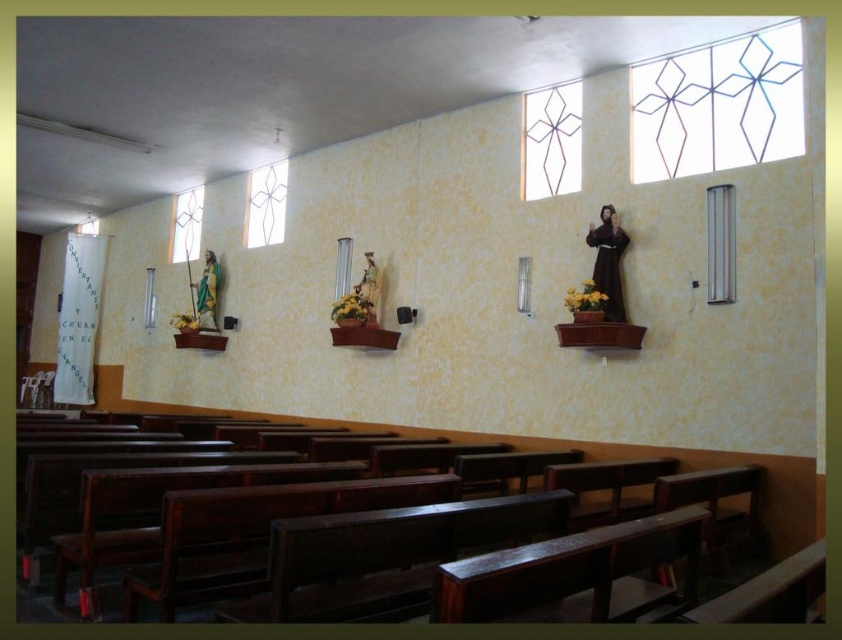
You are standing in the chapel and want to locate the clear glass window at right and the clear glass window at upper left. Based on their positions, which window is positioned to the east side of the chapel?

The clear glass window at right is positioned to the east side of the chapel because it is located to the right of the clear glass window at upper left, which typically indicates an eastern direction in such symmetrical structures.

You are an interior designer assessing the lighting in this space. Given that the clear glass window at right and the clear glass window at upper center are both sources of natural light, which one do you think allows more light into the room?

The clear glass window at upper center allows more light into the room because it occupies more space than the clear glass window at right.

You are an interior designer planning to install a new lighting fixture. You have two options for placement locations based on the clear glass window at upper right and the clear glass window at center. Which window would allow for a taller light fixture without blocking the window?

The clear glass window at upper right is much taller than the clear glass window at center, so the clear glass window at upper right would allow for a taller light fixture without blocking the window.